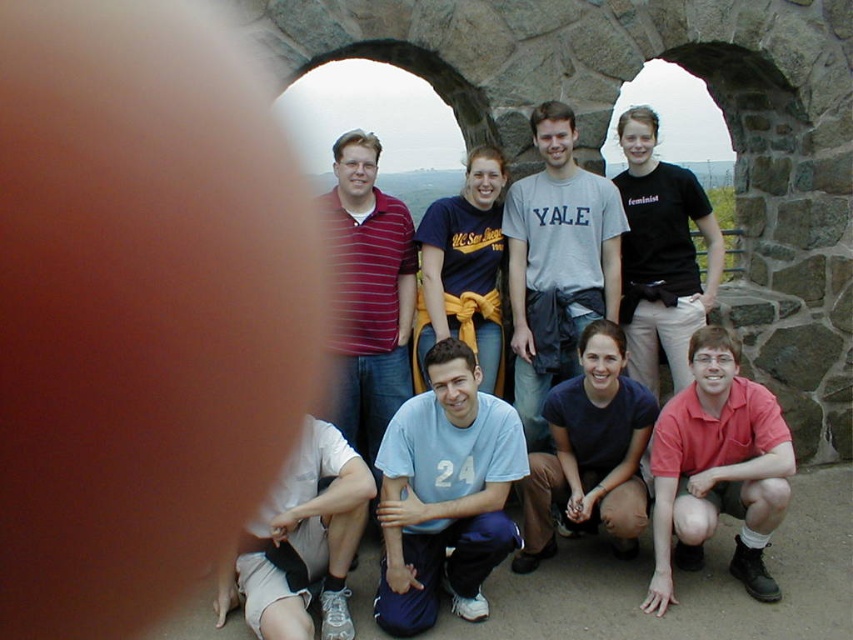
Question: Is light blue t-shirt at lower center behind black matte shirt at upper center?

Choices:
 (A) yes
 (B) no

Answer: (B)

Question: Considering the relative positions of gray cotton t-shirt at center and striped cotton shirt at center in the image provided, where is gray cotton t-shirt at center located with respect to striped cotton shirt at center?

Choices:
 (A) right
 (B) left

Answer: (A)

Question: Which of the following is the closest to the observer?

Choices:
 (A) (624, 188)
 (B) (300, 573)

Answer: (B)

Question: Is striped cotton shirt at center positioned before black matte shirt at upper center?

Choices:
 (A) no
 (B) yes

Answer: (B)

Question: Which point is farther to the camera?

Choices:
 (A) (611, 528)
 (B) (708, 280)
 (C) (508, 227)

Answer: (B)

Question: Which point is closer to the camera?

Choices:
 (A) light blue t-shirt at lower center
 (B) black matte shirt at upper center
 (C) red cotton shirt at lower right

Answer: (C)